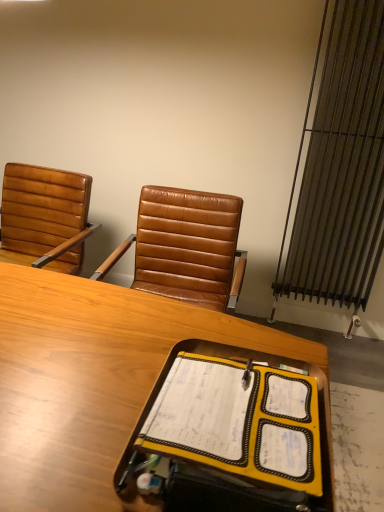
Question: Is metallic silver radiator at right not close to yellow fabric notebook at center?

Choices:
 (A) no
 (B) yes

Answer: (B)

Question: Does metallic silver radiator at right touch yellow fabric notebook at center?

Choices:
 (A) no
 (B) yes

Answer: (A)

Question: Does metallic silver radiator at right have a lesser height compared to yellow fabric notebook at center?

Choices:
 (A) no
 (B) yes

Answer: (A)

Question: Is metallic silver radiator at right aimed at yellow fabric notebook at center?

Choices:
 (A) no
 (B) yes

Answer: (B)

Question: Does metallic silver radiator at right have a lesser width compared to yellow fabric notebook at center?

Choices:
 (A) yes
 (B) no

Answer: (A)

Question: Does metallic silver radiator at right appear on the right side of yellow fabric notebook at center?

Choices:
 (A) no
 (B) yes

Answer: (B)

Question: Considering the relative sizes of wooden desk at center and yellow fabric notebook at center in the image provided, is wooden desk at center thinner than yellow fabric notebook at center?

Choices:
 (A) no
 (B) yes

Answer: (A)

Question: Would you consider wooden desk at center to be distant from yellow fabric notebook at center?

Choices:
 (A) yes
 (B) no

Answer: (B)

Question: Can we say wooden desk at center lies outside yellow fabric notebook at center?

Choices:
 (A) yes
 (B) no

Answer: (A)

Question: Is wooden desk at center smaller than yellow fabric notebook at center?

Choices:
 (A) no
 (B) yes

Answer: (A)

Question: Can you confirm if wooden desk at center is bigger than yellow fabric notebook at center?

Choices:
 (A) yes
 (B) no

Answer: (A)

Question: From the image's perspective, would you say wooden desk at center is positioned over yellow fabric notebook at center?

Choices:
 (A) no
 (B) yes

Answer: (A)

Question: From the image's perspective, does wooden desk at center appear lower than metallic silver radiator at right?

Choices:
 (A) no
 (B) yes

Answer: (B)